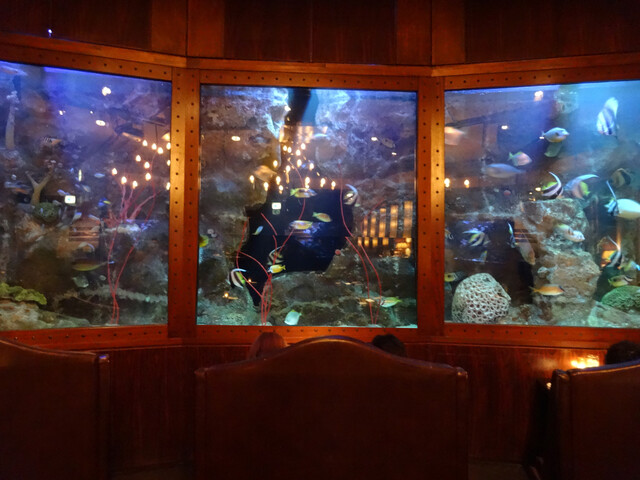
Where is `window 2`? The width and height of the screenshot is (640, 480). window 2 is located at coordinates (319, 79).